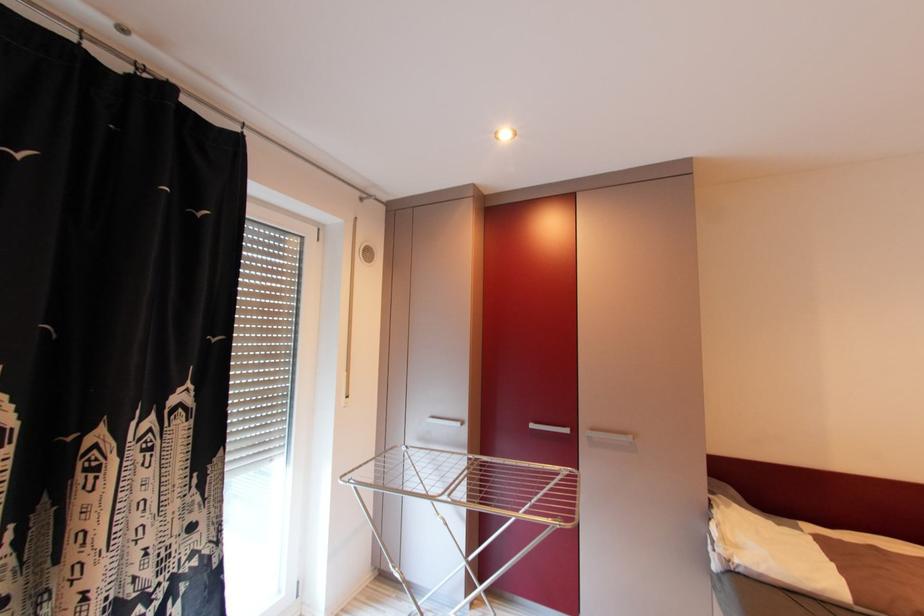
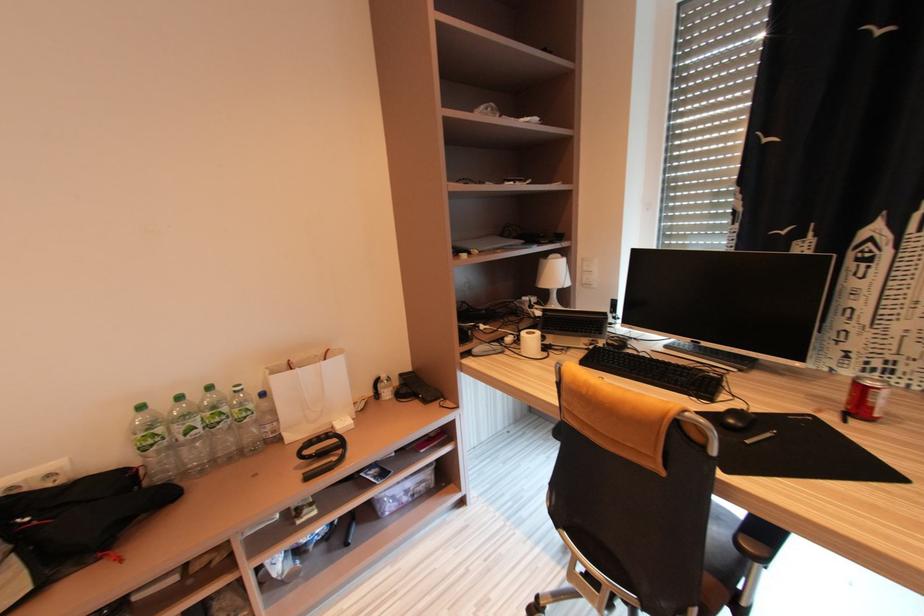
Question: The images are taken continuously from a first-person perspective. In which direction is your viewpoint rotating?

Choices:
 (A) Left
 (B) Right
 (C) Up
 (D) Down

Answer: (A)